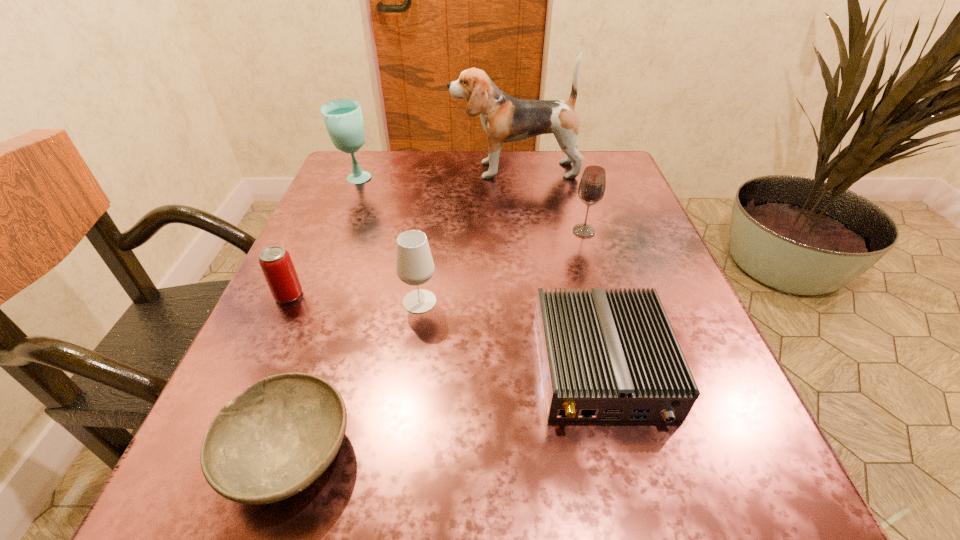
Where is `free space that is in between the tallest object and the bowl`? This screenshot has width=960, height=540. free space that is in between the tallest object and the bowl is located at coordinates (402, 312).

The height and width of the screenshot is (540, 960). Identify the location of vacant area between the tallest glass and the router. (479, 273).

Identify the location of free spot between the router and the puppy. This screenshot has width=960, height=540. (558, 268).

Identify the location of vacant space that is in between the farthest glass and the second glass from left to right. This screenshot has height=540, width=960. (388, 240).

Identify which object is located as the fourth nearest to the puppy. Please provide its 2D coordinates. Your answer should be formatted as a tuple, i.e. [(x, y)], where the tuple contains the x and y coordinates of a point satisfying the conditions above.

[(276, 264)]

Choose which object is the sixth nearest neighbor to the router. Please provide its 2D coordinates. Your answer should be formatted as a tuple, i.e. [(x, y)], where the tuple contains the x and y coordinates of a point satisfying the conditions above.

[(343, 118)]

I want to click on glass identified as the second closest to the bowl, so click(591, 189).

At what (x,y) coordinates should I click in order to perform the action: click on the second closest glass to the second glass from right to left. Please return your answer as a coordinate pair (x, y). Image resolution: width=960 pixels, height=540 pixels. Looking at the image, I should click on (343, 118).

The image size is (960, 540). Find the location of `free space that satisfies the following two spatial constraints: 1. on the back side of the fifth nearest object; 2. at the face of the tallest object`. free space that satisfies the following two spatial constraints: 1. on the back side of the fifth nearest object; 2. at the face of the tallest object is located at coordinates (565, 170).

This screenshot has width=960, height=540. Identify the location of vacant space that satisfies the following two spatial constraints: 1. on the back side of the rightmost glass; 2. at the face of the puppy. (565, 170).